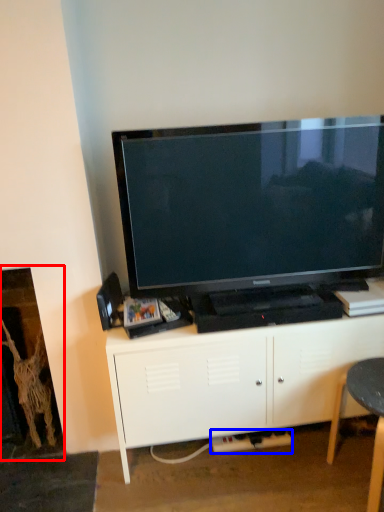
Question: Which object appears closest to the camera in this image, fireplace (highlighted by a red box) or plug (highlighted by a blue box)?

Choices:
 (A) fireplace
 (B) plug

Answer: (A)